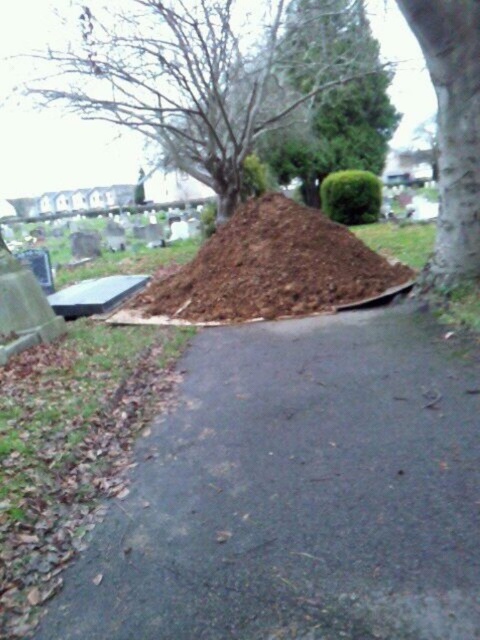
Question: Among these objects, which one is farthest from the camera?

Choices:
 (A) brown soil at center
 (B) bare branches at center

Answer: (B)

Question: Which object is positioned farthest from the brown soil at center?

Choices:
 (A) brown dirt at center
 (B) bare branches at center
 (C) smooth bark tree at right

Answer: (B)

Question: Where is brown dirt at center located in relation to bare branches at center in the image?

Choices:
 (A) left
 (B) right

Answer: (B)

Question: Is brown soil at center closer to camera compared to smooth bark tree at right?

Choices:
 (A) yes
 (B) no

Answer: (B)

Question: Which object appears closest to the camera in this image?

Choices:
 (A) brown soil at center
 (B) smooth bark tree at right
 (C) bare branches at center

Answer: (B)

Question: From the image, what is the correct spatial relationship of brown dirt at center in relation to smooth bark tree at right?

Choices:
 (A) above
 (B) below

Answer: (B)